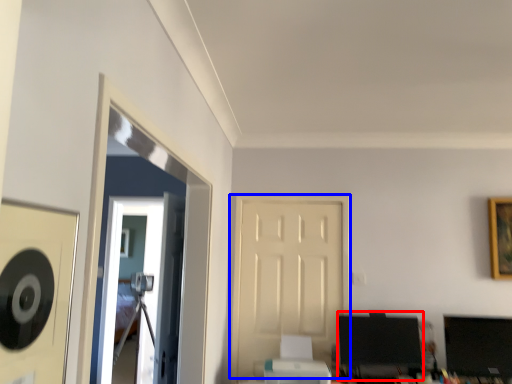
Question: Among these objects, which one is farthest to the camera, computer monitor (highlighted by a red box) or door (highlighted by a blue box)?

Choices:
 (A) computer monitor
 (B) door

Answer: (B)